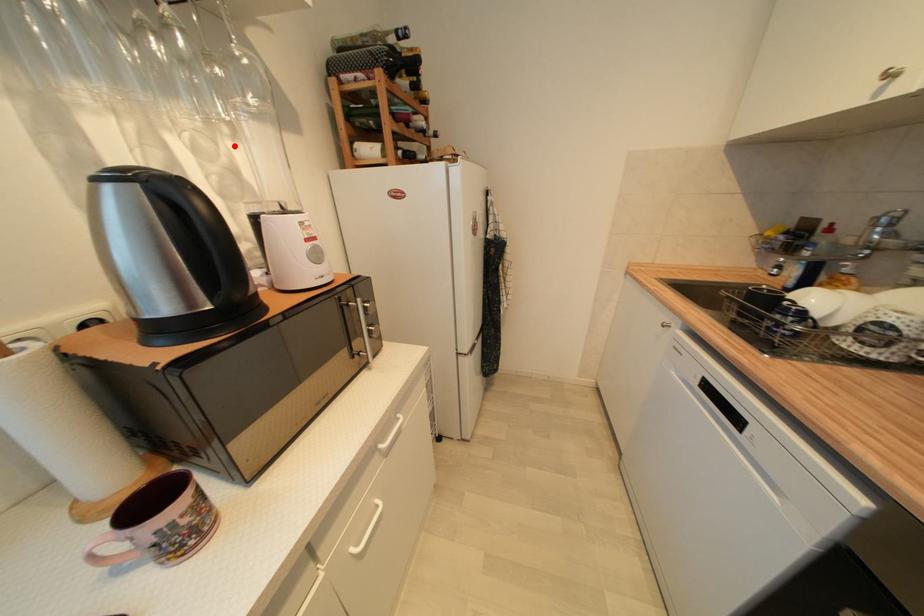
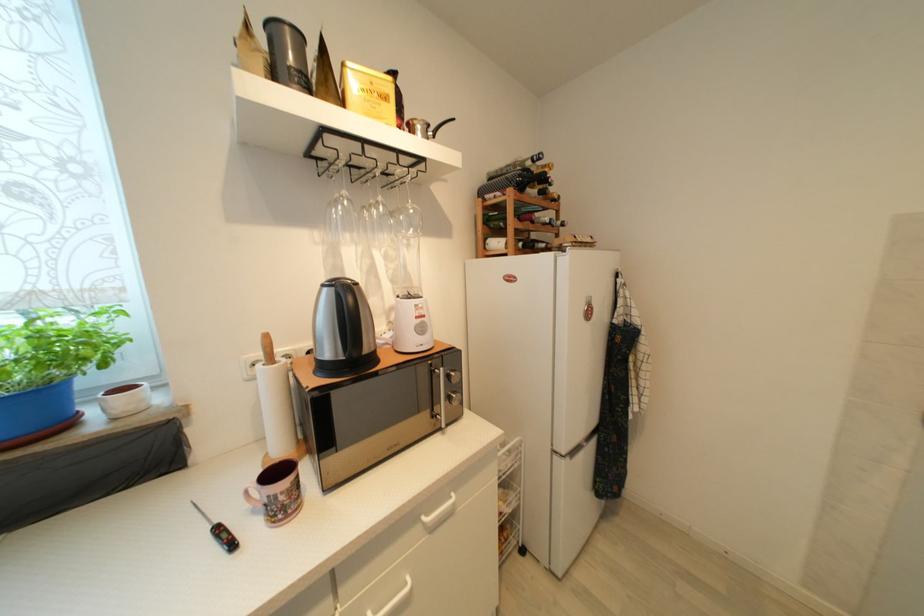
Where in the second image is the point corresponding to the highlighted location from the first image?

(409, 253)